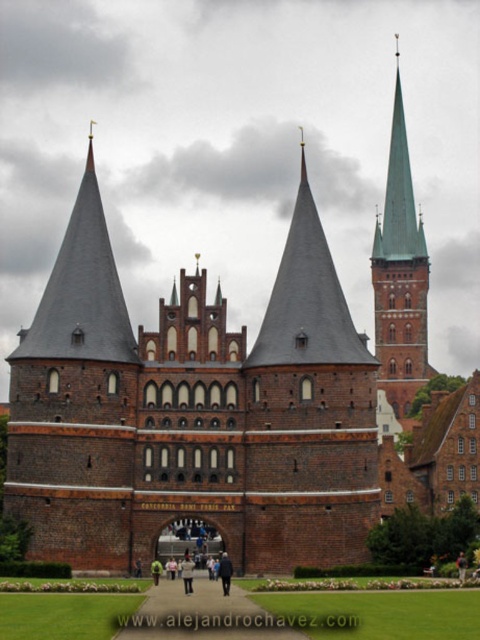
Question: Is green grass at center thinner than light beige sweater at center?

Choices:
 (A) yes
 (B) no

Answer: (B)

Question: Does black fabric person at center have a greater width compared to green fabric jacket at lower center?

Choices:
 (A) yes
 (B) no

Answer: (A)

Question: Which object is positioned farthest from the dark blue jacket at center?

Choices:
 (A) green spire at upper right
 (B) black fabric person at center
 (C) green grass at center
 (D) light beige sweater at center

Answer: (A)

Question: Does black fabric person at center appear under green fabric jacket at lower center?

Choices:
 (A) yes
 (B) no

Answer: (A)

Question: Which point is farther from the camera taking this photo?

Choices:
 (A) (208, 637)
 (B) (191, 557)

Answer: (B)

Question: Which of these objects is positioned closest to the light beige sweater at center?

Choices:
 (A) dark blue jacket at center
 (B) green spire at upper right

Answer: (A)